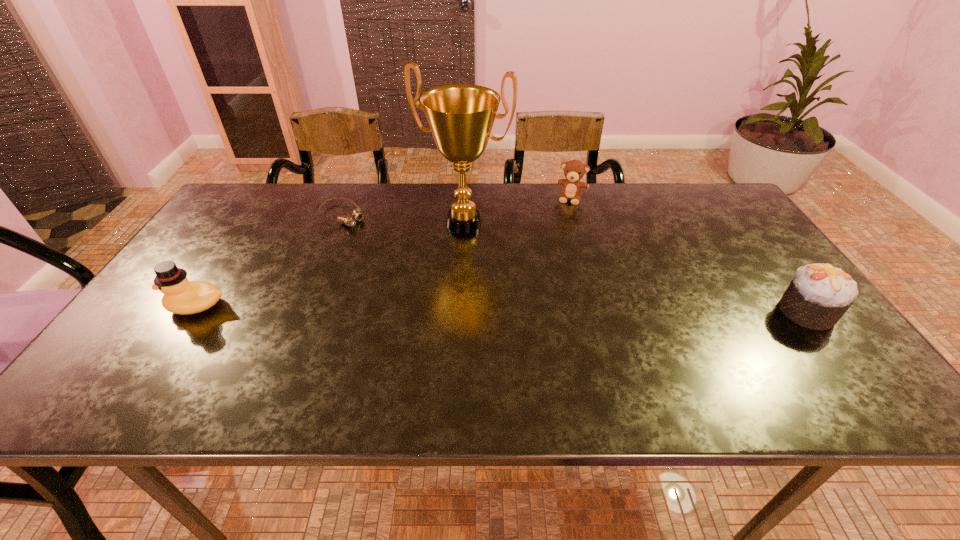
Where is `free point located 0.370m on the front view with handles of the award`? The width and height of the screenshot is (960, 540). free point located 0.370m on the front view with handles of the award is located at coordinates (395, 338).

This screenshot has width=960, height=540. Identify the location of free region located on the face of the teddy bear. (559, 240).

Find the location of a particular element. This screenshot has width=960, height=540. vacant area situated 0.310m on the face of the teddy bear is located at coordinates (551, 266).

Locate an element on the screen. The image size is (960, 540). vacant space situated 0.260m on the face of the teddy bear is located at coordinates (554, 254).

Where is `vacant region located on the front lenses and sides of the shortest object`? The height and width of the screenshot is (540, 960). vacant region located on the front lenses and sides of the shortest object is located at coordinates (430, 276).

Locate an element on the screen. The height and width of the screenshot is (540, 960). free space located on the front lenses and sides of the shortest object is located at coordinates (381, 242).

This screenshot has height=540, width=960. In order to click on free space located 0.320m on the front lenses and sides of the shortest object in this screenshot , I will do `click(428, 275)`.

Identify the location of award that is at the far edge. The width and height of the screenshot is (960, 540). (460, 116).

You are a GUI agent. You are given a task and a screenshot of the screen. Output one action in this format:
    pyautogui.click(x=<x>, y=<y>)
    Task: Click on the teddy bear that is at the far edge
    Image resolution: width=960 pixels, height=540 pixels.
    Given the screenshot: What is the action you would take?
    pyautogui.click(x=574, y=170)

What are the coordinates of `goggles at the far edge` in the screenshot? It's located at (347, 220).